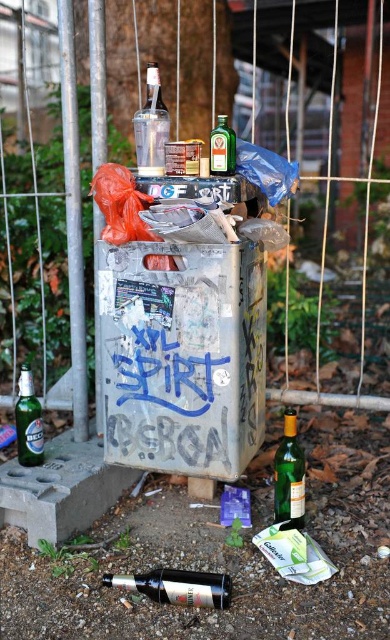
Does blue graffiti at center have a greater width compared to green glass bottle at center?

Indeed, blue graffiti at center has a greater width compared to green glass bottle at center.

Does blue graffiti at center appear over green glass bottle at center?

Yes, blue graffiti at center is above green glass bottle at center.

Locate an element on the screen. The image size is (390, 640). blue graffiti at center is located at coordinates point(168,440).

This screenshot has height=640, width=390. Find the location of `blue graffiti at center`. blue graffiti at center is located at coordinates (168, 440).

Between translucent glass wine bottle at lower center and green glass bottle at lower left, which one appears on the right side from the viewer's perspective?

Positioned to the right is translucent glass wine bottle at lower center.

Who is lower down, translucent glass wine bottle at lower center or green glass bottle at lower left?

Positioned lower is translucent glass wine bottle at lower center.

Is point (166, 579) farther from camera compared to point (23, 460)?

No, it is not.

Find the location of a particular element. translucent glass wine bottle at lower center is located at coordinates pyautogui.click(x=177, y=586).

What do you see at coordinates (177, 339) in the screenshot? Image resolution: width=390 pixels, height=640 pixels. I see `silver metallic trash can at center` at bounding box center [177, 339].

Can you confirm if silver metallic trash can at center is positioned above green glass bottle at upper center?

No.

Does point (189, 464) lie behind point (226, 131)?

That is True.

The width and height of the screenshot is (390, 640). What are the coordinates of `silver metallic trash can at center` in the screenshot? It's located at (177, 339).